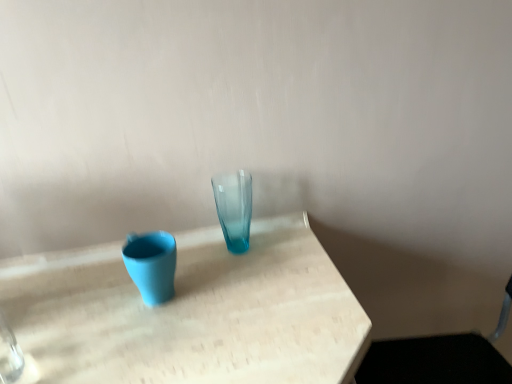
Question: Considering the relative positions of translucent glass vase at center, marked as the 2th vase in a left-to-right arrangement, and matte blue vase at left, the 1th vase from the left, in the image provided, is translucent glass vase at center, marked as the 2th vase in a left-to-right arrangement, to the right of matte blue vase at left, the 1th vase from the left, from the viewer's perspective?

Choices:
 (A) no
 (B) yes

Answer: (B)

Question: Does translucent glass vase at center, the 1th vase in the right-to-left sequence, have a lesser height compared to matte blue vase at left, the 1th vase from the left?

Choices:
 (A) no
 (B) yes

Answer: (A)

Question: Is translucent glass vase at center, marked as the 2th vase in a left-to-right arrangement, far from matte blue vase at left, the 2th vase viewed from the right?

Choices:
 (A) no
 (B) yes

Answer: (A)

Question: From a real-world perspective, is translucent glass vase at center, marked as the 2th vase in a left-to-right arrangement, below matte blue vase at left, the 2th vase viewed from the right?

Choices:
 (A) no
 (B) yes

Answer: (A)

Question: Can you confirm if translucent glass vase at center, marked as the 2th vase in a left-to-right arrangement, is positioned to the left of matte blue vase at left, the 2th vase viewed from the right?

Choices:
 (A) yes
 (B) no

Answer: (B)

Question: Would you say matte blue vase at left, the 2th vase viewed from the right, is part of translucent glass vase at center, marked as the 2th vase in a left-to-right arrangement,'s contents?

Choices:
 (A) yes
 (B) no

Answer: (B)

Question: Is translucent glass vase at center, the 1th vase in the right-to-left sequence, closer to the viewer compared to metallic silver swivel chair at lower right?

Choices:
 (A) yes
 (B) no

Answer: (B)

Question: Can you confirm if translucent glass vase at center, the 1th vase in the right-to-left sequence, is thinner than metallic silver swivel chair at lower right?

Choices:
 (A) yes
 (B) no

Answer: (A)

Question: From a real-world perspective, is translucent glass vase at center, marked as the 2th vase in a left-to-right arrangement, physically above metallic silver swivel chair at lower right?

Choices:
 (A) yes
 (B) no

Answer: (A)

Question: Is translucent glass vase at center, marked as the 2th vase in a left-to-right arrangement, further to the viewer compared to metallic silver swivel chair at lower right?

Choices:
 (A) no
 (B) yes

Answer: (B)

Question: Does translucent glass vase at center, the 1th vase in the right-to-left sequence, contain metallic silver swivel chair at lower right?

Choices:
 (A) no
 (B) yes

Answer: (A)

Question: Is translucent glass vase at center, marked as the 2th vase in a left-to-right arrangement, looking in the opposite direction of metallic silver swivel chair at lower right?

Choices:
 (A) yes
 (B) no

Answer: (B)

Question: Considering the relative positions of metallic silver swivel chair at lower right and translucent glass vase at center, the 1th vase in the right-to-left sequence, in the image provided, is metallic silver swivel chair at lower right to the left of translucent glass vase at center, the 1th vase in the right-to-left sequence, from the viewer's perspective?

Choices:
 (A) no
 (B) yes

Answer: (A)